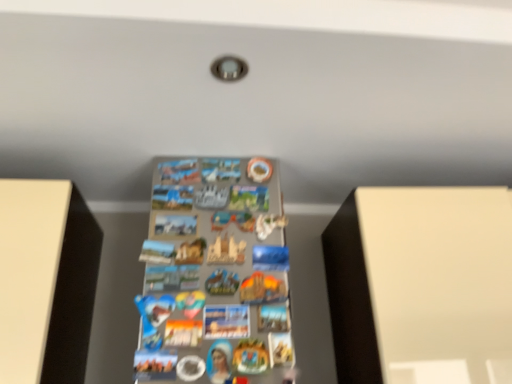
In order to click on metallic silver magnets at center in this screenshot , I will do `click(214, 273)`.

This screenshot has height=384, width=512. What do you see at coordinates (214, 273) in the screenshot? I see `metallic silver magnets at center` at bounding box center [214, 273].

Describe the element at coordinates (421, 285) in the screenshot. Image resolution: width=512 pixels, height=384 pixels. I see `white matte cabinet at right` at that location.

At what (x,y) coordinates should I click in order to perform the action: click on white matte cabinet at right. Please return your answer as a coordinate pair (x, y). Image resolution: width=512 pixels, height=384 pixels. Looking at the image, I should click on (421, 285).

Where is `metallic silver magnets at center`? This screenshot has width=512, height=384. metallic silver magnets at center is located at coordinates (214, 273).

Does metallic silver magnets at center appear on the right side of white matte cabinet at right?

No.

Does metallic silver magnets at center come in front of white matte cabinet at right?

Yes, metallic silver magnets at center is in front of white matte cabinet at right.

Is point (202, 272) behind point (420, 381)?

Yes, it is.

From the image's perspective, between metallic silver magnets at center and white matte cabinet at right, who is located below?

white matte cabinet at right is shown below in the image.

From a real-world perspective, is metallic silver magnets at center below white matte cabinet at right?

Incorrect, from a real-world perspective, metallic silver magnets at center is higher than white matte cabinet at right.

Is metallic silver magnets at center wider than white matte cabinet at right?

Correct, the width of metallic silver magnets at center exceeds that of white matte cabinet at right.

Does metallic silver magnets at center have a greater height compared to white matte cabinet at right?

Indeed, metallic silver magnets at center has a greater height compared to white matte cabinet at right.

Looking at the image, does metallic silver magnets at center seem bigger or smaller compared to white matte cabinet at right?

Clearly, metallic silver magnets at center is smaller in size than white matte cabinet at right.

Is white matte cabinet at right located within metallic silver magnets at center?

No, white matte cabinet at right is located outside of metallic silver magnets at center.

Is metallic silver magnets at center far from white matte cabinet at right?

No, metallic silver magnets at center is not far away from white matte cabinet at right.

Is metallic silver magnets at center oriented towards white matte cabinet at right?

No.

This screenshot has height=384, width=512. I want to click on furniture on the right of metallic silver magnets at center, so click(x=421, y=285).

Can you confirm if white matte cabinet at right is positioned to the right of metallic silver magnets at center?

Yes.

Relative to metallic silver magnets at center, is white matte cabinet at right in front or behind?

In the image, white matte cabinet at right appears behind metallic silver magnets at center.

Does point (444, 353) come behind point (234, 360)?

No, (444, 353) is closer to viewer.

From the image's perspective, is white matte cabinet at right located above metallic silver magnets at center?

No.

From a real-world perspective, is white matte cabinet at right beneath metallic silver magnets at center?

Yes.

Is white matte cabinet at right wider or thinner than metallic silver magnets at center?

Clearly, white matte cabinet at right has less width compared to metallic silver magnets at center.

In terms of height, does white matte cabinet at right look taller or shorter compared to metallic silver magnets at center?

Clearly, white matte cabinet at right is shorter compared to metallic silver magnets at center.

Is white matte cabinet at right smaller than metallic silver magnets at center?

Incorrect, white matte cabinet at right is not smaller in size than metallic silver magnets at center.

Is metallic silver magnets at center located within white matte cabinet at right?

Actually, metallic silver magnets at center is outside white matte cabinet at right.

Is white matte cabinet at right far away from metallic silver magnets at center?

They are positioned close to each other.

Could you tell me if white matte cabinet at right is turned towards metallic silver magnets at center?

No.

The width and height of the screenshot is (512, 384). What are the coordinates of `furniture behind the metallic silver magnets at center` in the screenshot? It's located at (421, 285).

The width and height of the screenshot is (512, 384). Identify the location of furniture on the right of metallic silver magnets at center. (421, 285).

I want to click on furniture located underneath the metallic silver magnets at center (from a real-world perspective), so click(421, 285).